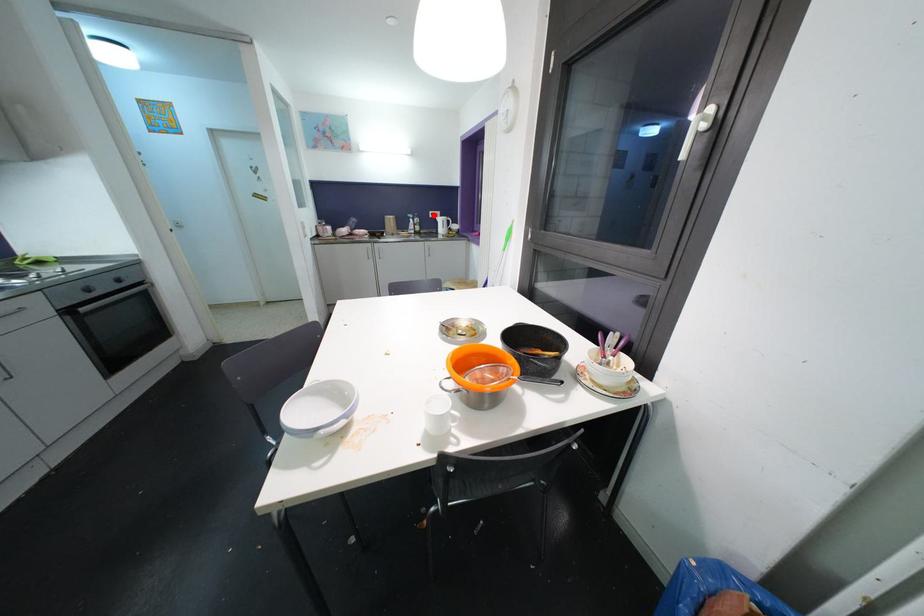
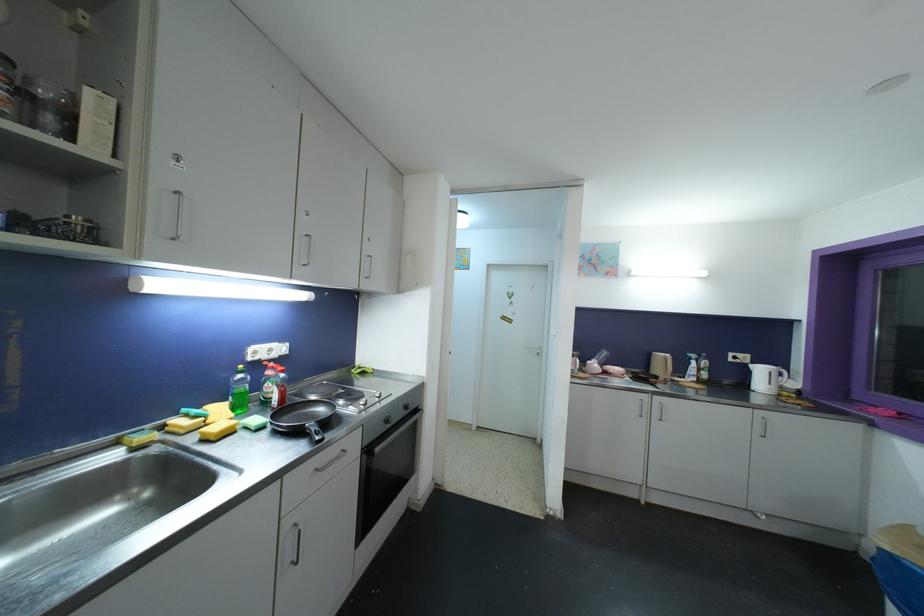
Find the pixel in the second image that matches the highlighted location in the first image.

(734, 357)